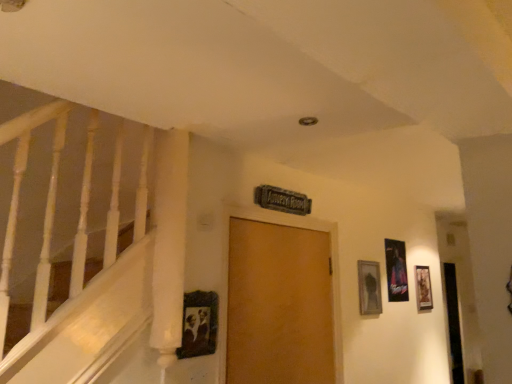
Question: Could wooden picture frame at right, which ranks as the 1th picture frame in back-to-front order, be considered to be inside metallic silver picture frame at right, the 3th picture frame viewed from the left?

Choices:
 (A) no
 (B) yes

Answer: (A)

Question: Is metallic silver picture frame at right, the 2th picture frame viewed from the back, placed right next to wooden picture frame at right, which ranks as the first picture frame in right-to-left order?

Choices:
 (A) yes
 (B) no

Answer: (B)

Question: From the image's perspective, does metallic silver picture frame at right, placed as the third picture frame when sorted from front to back, appear lower than wooden picture frame at right, which ranks as the first picture frame in right-to-left order?

Choices:
 (A) no
 (B) yes

Answer: (A)

Question: Is metallic silver picture frame at right, the 2th picture frame viewed from the back, at the left side of wooden picture frame at right, which is the fourth picture frame from front to back?

Choices:
 (A) yes
 (B) no

Answer: (A)

Question: Is metallic silver picture frame at right, the 2th picture frame viewed from the back, oriented away from wooden picture frame at right, which ranks as the first picture frame in right-to-left order?

Choices:
 (A) yes
 (B) no

Answer: (B)

Question: From the image's perspective, is wooden vintage frame at center, acting as the fourth picture frame starting from the right, located above or below wooden picture frame at upper right, the second picture frame when ordered from front to back?

Choices:
 (A) below
 (B) above

Answer: (B)

Question: Considering the positions of wooden vintage frame at center, the first picture frame in the left-to-right sequence, and wooden picture frame at upper right, the 2th picture frame positioned from the left, in the image, is wooden vintage frame at center, the first picture frame in the left-to-right sequence, wider or thinner than wooden picture frame at upper right, the 2th picture frame positioned from the left,?

Choices:
 (A) wide
 (B) thin

Answer: (B)

Question: In terms of height, does wooden vintage frame at center, the fourth picture frame in the back-to-front sequence, look taller or shorter compared to wooden picture frame at upper right, arranged as the third picture frame when viewed from the back?

Choices:
 (A) short
 (B) tall

Answer: (A)

Question: Is wooden vintage frame at center, the 1th picture frame viewed from the front, bigger or smaller than wooden picture frame at upper right, the 2th picture frame positioned from the left?

Choices:
 (A) big
 (B) small

Answer: (B)

Question: In terms of size, does metallic silver picture frame at right, the second picture frame in the right-to-left sequence, appear bigger or smaller than wooden picture frame at right, acting as the 4th picture frame starting from the left?

Choices:
 (A) small
 (B) big

Answer: (B)

Question: Relative to wooden picture frame at right, acting as the 4th picture frame starting from the left, is metallic silver picture frame at right, the second picture frame in the right-to-left sequence, in front or behind?

Choices:
 (A) front
 (B) behind

Answer: (A)

Question: Which is correct: metallic silver picture frame at right, the 2th picture frame viewed from the back, is inside wooden picture frame at right, which ranks as the 1th picture frame in back-to-front order, or outside of it?

Choices:
 (A) outside
 (B) inside

Answer: (A)

Question: Is point (397, 278) closer or farther from the camera than point (418, 273)?

Choices:
 (A) closer
 (B) farther

Answer: (A)

Question: Considering the positions of wooden picture frame at right, which is the fourth picture frame from front to back, and metallic silver picture frame at right, the 2th picture frame viewed from the back, in the image, is wooden picture frame at right, which is the fourth picture frame from front to back, taller or shorter than metallic silver picture frame at right, the 2th picture frame viewed from the back,?

Choices:
 (A) short
 (B) tall

Answer: (A)

Question: Do you think wooden picture frame at right, which is the fourth picture frame from front to back, is within metallic silver picture frame at right, the second picture frame in the right-to-left sequence, or outside of it?

Choices:
 (A) inside
 (B) outside

Answer: (B)